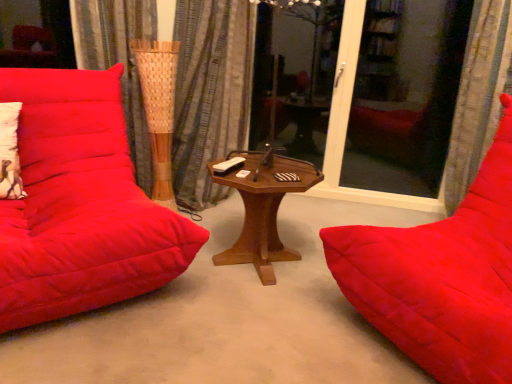
This screenshot has width=512, height=384. What are the coordinates of `free space to the back side of wooden hexagonal table at center` in the screenshot? It's located at click(x=276, y=218).